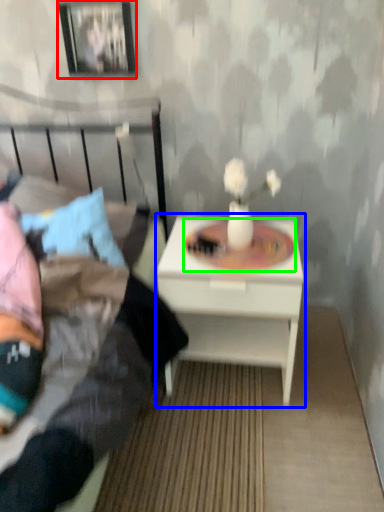
Question: Estimate the real-world distances between objects in this image. Which object is farther from picture frame (highlighted by a red box), nightstand (highlighted by a blue box) or round table (highlighted by a green box)?

Choices:
 (A) nightstand
 (B) round table

Answer: (A)